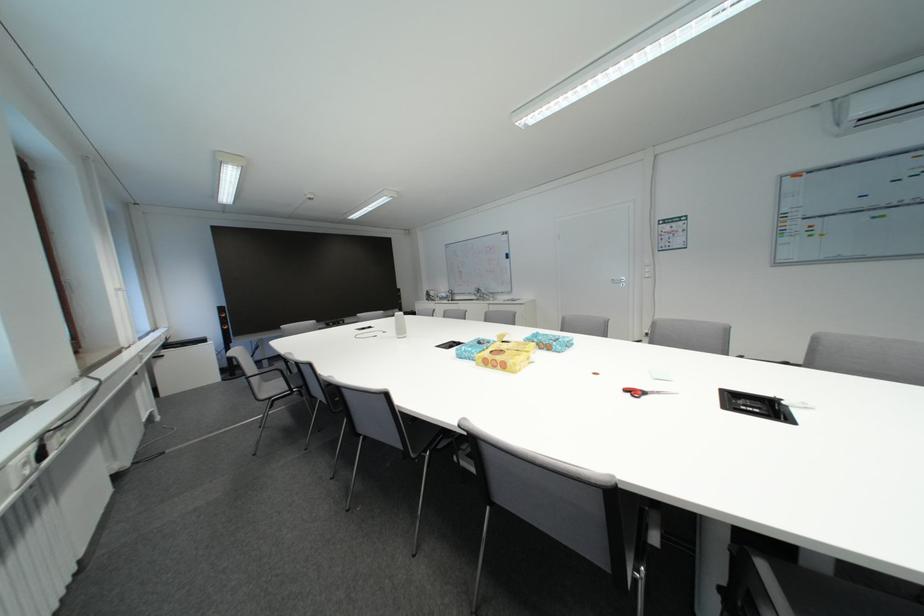
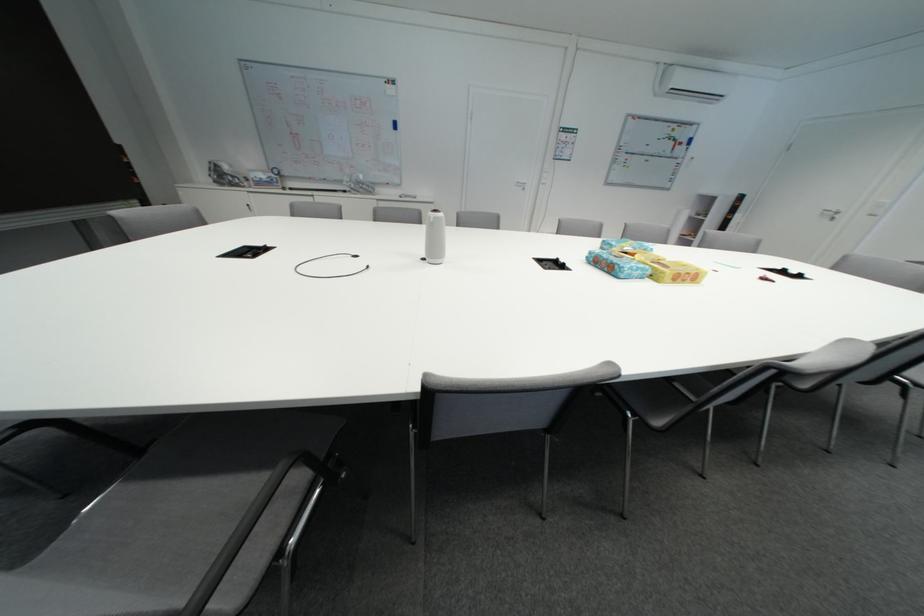
Find the pixel in the second image that matches [505,370] in the first image.

(694, 283)